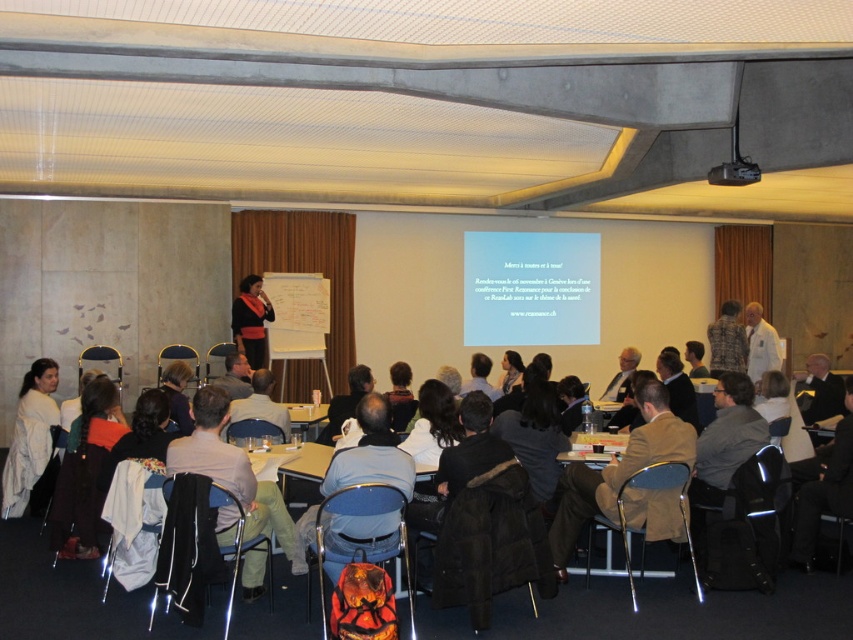
Question: Which point is closer to the camera?

Choices:
 (A) (646, 492)
 (B) (265, 342)
 (C) (358, 460)
 (D) (717, 339)

Answer: (C)

Question: Is brown leather jacket at lower center wider than black plastic projector at upper center?

Choices:
 (A) yes
 (B) no

Answer: (A)

Question: Can you confirm if blue matte projection screen at center is thinner than white clothed person at right?

Choices:
 (A) yes
 (B) no

Answer: (B)

Question: Among these objects, which one is nearest to the camera?

Choices:
 (A) blue fabric jacket at center
 (B) patterned fabric jacket at center
 (C) blue matte projection screen at center
 (D) white clothed person at right

Answer: (A)

Question: Does patterned fabric jacket at center lie behind black plastic projector at upper center?

Choices:
 (A) no
 (B) yes

Answer: (B)

Question: Which object is the farthest from the patterned fabric jacket at center?

Choices:
 (A) white clothed person at right
 (B) blue fabric jacket at center
 (C) matte black jacket at center
 (D) brown leather jacket at lower center

Answer: (B)